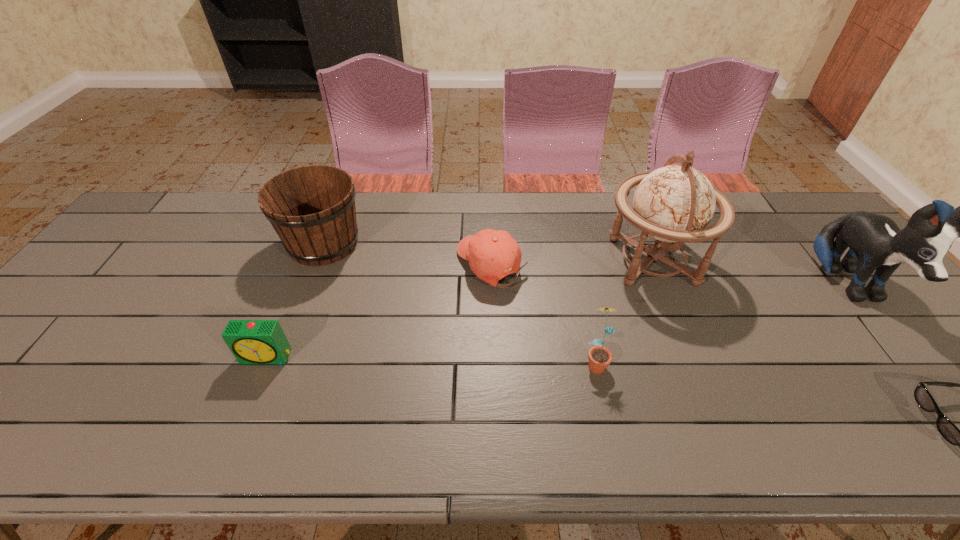
Locate an element on the screen. This screenshot has height=540, width=960. vacant space that satisfies the following two spatial constraints: 1. on the front-facing side of the third object from right to left; 2. on the front-facing side of the alarm clock is located at coordinates (691, 357).